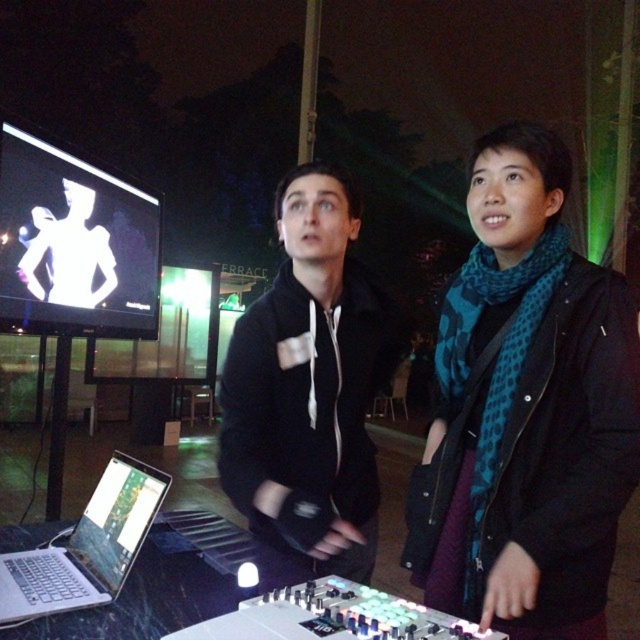
What are the coordinates of `teal dotted scarf at center` in the screenshot? It's located at (525, 410).

Which is above, teal dotted scarf at center or black matte jacket at center?

teal dotted scarf at center

Is point (536, 234) closer to viewer compared to point (291, 461)?

Yes, point (536, 234) is in front of point (291, 461).

You are a GUI agent. You are given a task and a screenshot of the screen. Output one action in this format:
    pyautogui.click(x=<x>, y=<y>)
    Task: Click on the teal dotted scarf at center
    
    Given the screenshot: What is the action you would take?
    (x=525, y=410)

Looking at this image, can you confirm if teal dotted scarf at center is positioned to the right of metallic silver laptop at lower left?

Yes, teal dotted scarf at center is to the right of metallic silver laptop at lower left.

Does teal dotted scarf at center have a lesser width compared to metallic silver laptop at lower left?

Correct, teal dotted scarf at center's width is less than metallic silver laptop at lower left's.

Is point (461, 451) closer to camera compared to point (61, 632)?

No, it is not.

Locate an element on the screen. teal dotted scarf at center is located at coordinates (525, 410).

Does black matte jacket at center have a lesser width compared to silver metallic laptop at lower left?

In fact, black matte jacket at center might be wider than silver metallic laptop at lower left.

Can you confirm if black matte jacket at center is positioned to the left of silver metallic laptop at lower left?

Incorrect, black matte jacket at center is not on the left side of silver metallic laptop at lower left.

Identify the location of black matte jacket at center. Image resolution: width=640 pixels, height=640 pixels. (308, 388).

Identify the location of black matte jacket at center. (308, 388).